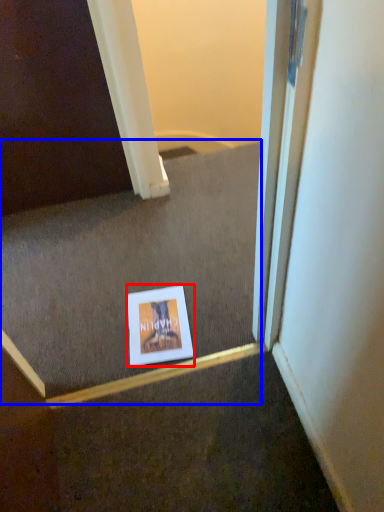
Question: Which of the following is the closest to the observer, picture frame (highlighted by a red box) or stairwell (highlighted by a blue box)?

Choices:
 (A) picture frame
 (B) stairwell

Answer: (B)